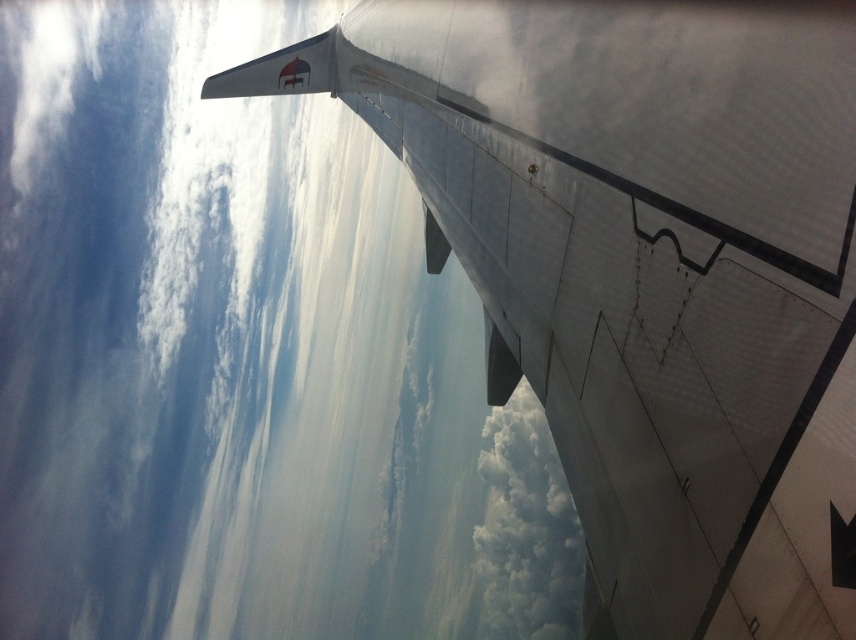
Does white matte wing at upper center have a greater width compared to metallic silver wing at upper right?

Yes, white matte wing at upper center is wider than metallic silver wing at upper right.

At what (x,y) coordinates should I click in order to perform the action: click on white matte wing at upper center. Please return your answer as a coordinate pair (x, y). This screenshot has height=640, width=856. Looking at the image, I should click on (242, 360).

How far apart are white matte wing at upper center and white fluffy cloud at upper center?

white matte wing at upper center is 30.28 feet from white fluffy cloud at upper center.

Is white matte wing at upper center positioned at the back of white fluffy cloud at upper center?

Yes, it is.

Between point (275, 140) and point (565, 570), which one is positioned behind?

The point (565, 570) is more distant.

Find the location of a particular element. The width and height of the screenshot is (856, 640). white matte wing at upper center is located at coordinates (242, 360).

Can you confirm if metallic silver wing at upper right is positioned below white fluffy cloud at upper center?

No.

Which is behind, point (477, 88) or point (580, 564)?

Point (580, 564)

The width and height of the screenshot is (856, 640). I want to click on metallic silver wing at upper right, so click(x=651, y=104).